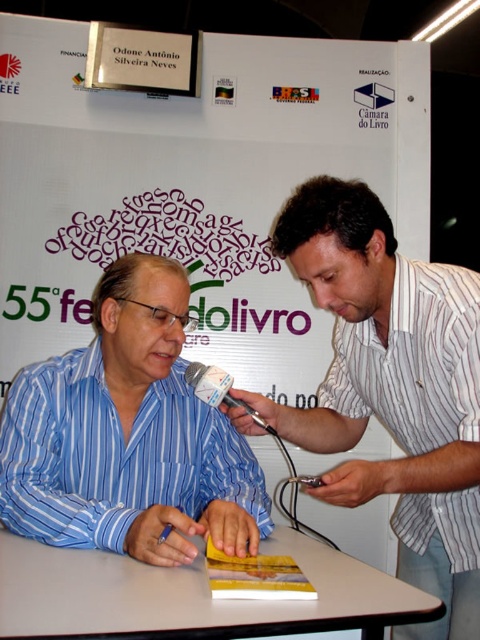
Question: Estimate the real-world distances between objects in this image. Which object is farther from the white striped shirt at center?

Choices:
 (A) white striped shirt at right
 (B) blue striped shirt at center

Answer: (B)

Question: Can you confirm if white striped shirt at center is bigger than white striped shirt at right?

Choices:
 (A) no
 (B) yes

Answer: (B)

Question: Can you confirm if white striped shirt at center is thinner than white striped shirt at right?

Choices:
 (A) no
 (B) yes

Answer: (A)

Question: Can you confirm if blue striped shirt at center is positioned to the right of white striped shirt at right?

Choices:
 (A) yes
 (B) no

Answer: (B)

Question: Which point is farther from the camera taking this photo?

Choices:
 (A) (61, 541)
 (B) (395, 433)

Answer: (B)

Question: Which object is the farthest from the blue striped shirt at center?

Choices:
 (A) white striped shirt at right
 (B) white striped shirt at center

Answer: (A)